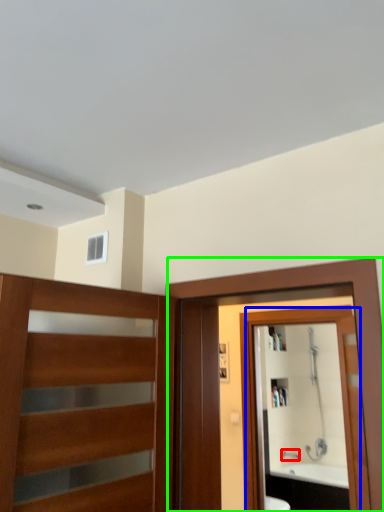
Question: Which object is positioned farthest from faucet (highlighted by a red box)? Select from mirror (highlighted by a blue box) and screen door (highlighted by a green box).

Choices:
 (A) mirror
 (B) screen door

Answer: (B)